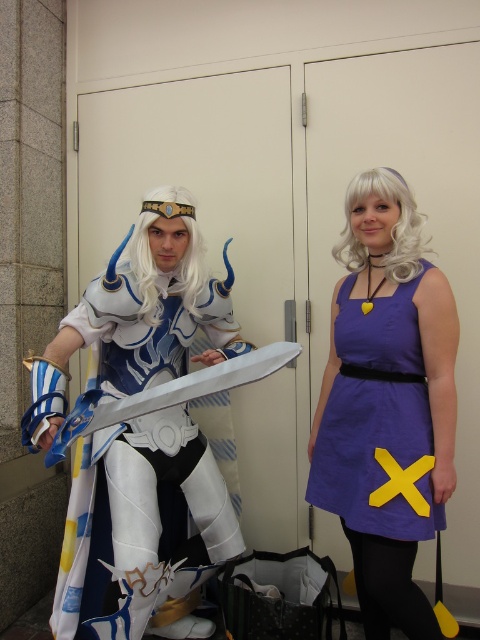
You are a photographer at a cosplay event. You need to position the purple fabric dress at center and the white glossy armor at center so that both fit within a 2m wide photo frame. Given their widths, which character should be placed closer to the edges to ensure both fit?

The purple fabric dress at center has a lesser width compared to white glossy armor at center, so the white glossy armor at center should be placed closer to the center to take up more space, while the purple fabric dress at center can be positioned near the edges to ensure both fit within the 2m wide frame.

You are a photographer at a cosplay event and need to position the purple fabric dress at center and the white glossy armor at center correctly. According to the scene, which costume should be placed to the left?

The white glossy armor at center should be placed to the left because the purple fabric dress at center is to the right of it.